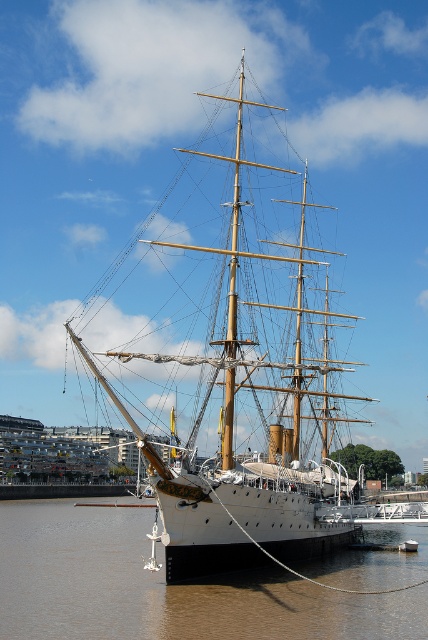
You are standing on the dock and see a point marked at coordinates (x=250, y=388). Based on the scene described, what object does this point most likely correspond to?

The point corresponds to the white polished wood sailboat at center.

You are standing on the dock and looking at the ship. There are two points marked on the ship. The first point is at coordinate point (243, 513) and the second point is at coordinate point (379, 605). Which point appears closer to you?

Point (243, 513) is further to the camera than point (379, 605), so the second point at (379, 605) appears closer to you.